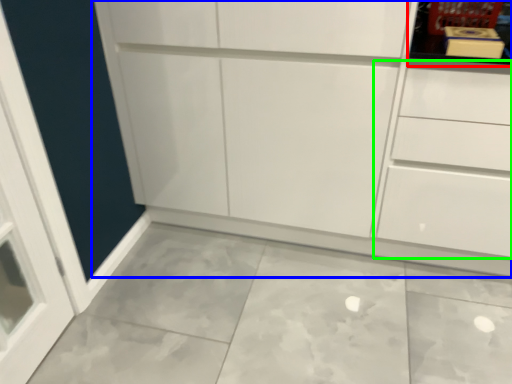
Question: Which object is positioned farthest from shelf (highlighted by a red box)? Select from cupboard (highlighted by a blue box) and drawer (highlighted by a green box).

Choices:
 (A) cupboard
 (B) drawer

Answer: (A)